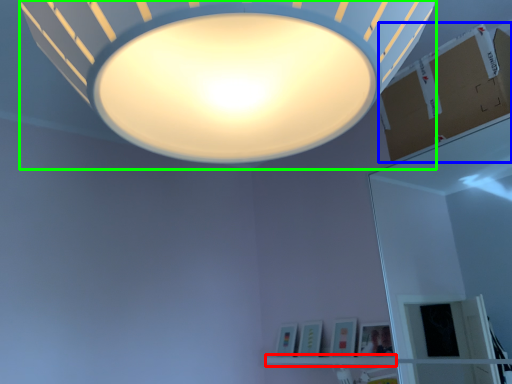
Question: Which object is the closest to the shelf (highlighted by a red box)? Choose among these: cardboard box (highlighted by a blue box) or lamp (highlighted by a green box).

Choices:
 (A) cardboard box
 (B) lamp

Answer: (A)